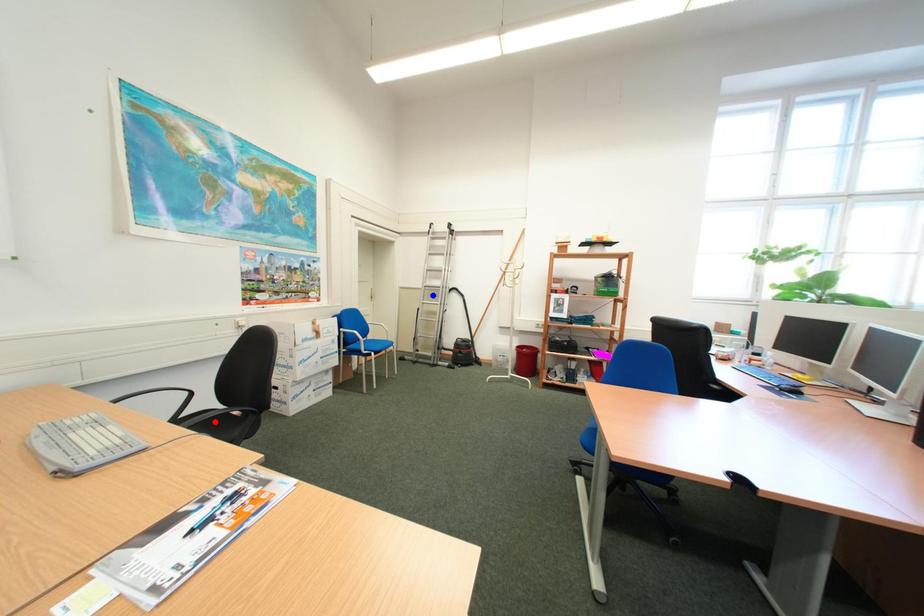
Question: In the image, two points are highlighted. Which point is nearer to the camera? Reply with the corresponding letter.

Choices:
 (A) blue point
 (B) red point

Answer: (B)